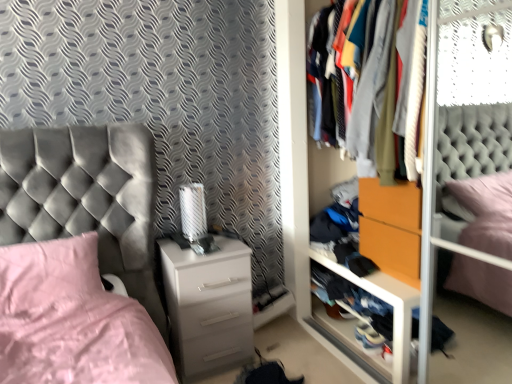
Where is `free space to the left of wooden shelf at lower right`? The image size is (512, 384). free space to the left of wooden shelf at lower right is located at coordinates (304, 352).